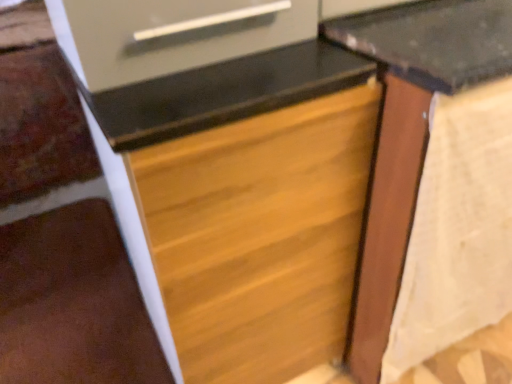
Question: Would you consider wooden drawer at center to be distant from wooden table at center?

Choices:
 (A) no
 (B) yes

Answer: (A)

Question: From the image's perspective, is wooden drawer at center beneath wooden table at center?

Choices:
 (A) no
 (B) yes

Answer: (B)

Question: Could you tell me if wooden drawer at center is turned towards wooden table at center?

Choices:
 (A) yes
 (B) no

Answer: (B)

Question: Is wooden drawer at center not inside wooden table at center?

Choices:
 (A) yes
 (B) no

Answer: (A)

Question: Does wooden drawer at center have a lesser height compared to wooden table at center?

Choices:
 (A) yes
 (B) no

Answer: (A)

Question: In terms of width, does wooden drawer at center look wider or thinner when compared to wooden table at center?

Choices:
 (A) wide
 (B) thin

Answer: (A)

Question: From their relative heights in the image, would you say wooden drawer at center is taller or shorter than wooden table at center?

Choices:
 (A) short
 (B) tall

Answer: (A)

Question: Looking at the image, does wooden drawer at center seem bigger or smaller compared to wooden table at center?

Choices:
 (A) big
 (B) small

Answer: (B)

Question: Considering the relative positions of wooden drawer at center and wooden table at center in the image provided, is wooden drawer at center to the left or to the right of wooden table at center?

Choices:
 (A) left
 (B) right

Answer: (A)

Question: Does point (53, 347) appear closer or farther from the camera than point (309, 321)?

Choices:
 (A) farther
 (B) closer

Answer: (A)

Question: From a real-world perspective, is brown wood stairwell at lower left positioned above or below wooden drawer at center?

Choices:
 (A) above
 (B) below

Answer: (B)

Question: Is brown wood stairwell at lower left in front of or behind wooden drawer at center in the image?

Choices:
 (A) front
 (B) behind

Answer: (B)

Question: Is brown wood stairwell at lower left taller or shorter than wooden drawer at center?

Choices:
 (A) short
 (B) tall

Answer: (A)

Question: From a real-world perspective, relative to brown wood stairwell at lower left, is wooden drawer at center vertically above or below?

Choices:
 (A) below
 (B) above

Answer: (B)

Question: Relative to brown wood stairwell at lower left, is wooden drawer at center in front or behind?

Choices:
 (A) front
 (B) behind

Answer: (A)